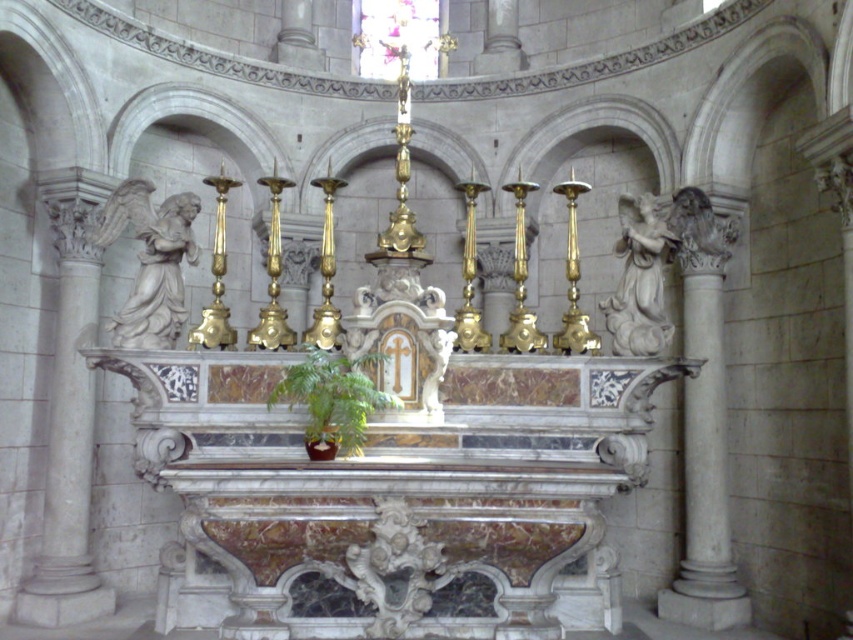
Between white marble column at right and white marble angel at left, which one is positioned higher?

white marble angel at left

Does point (688, 208) come behind point (169, 307)?

That is True.

Who is more distant from viewer, (718, 506) or (126, 346)?

Point (718, 506)

Identify the location of white marble column at right. (703, 424).

Does white marble angel at right have a smaller size compared to green leafy plant at center?

Incorrect, white marble angel at right is not smaller in size than green leafy plant at center.

Is white marble angel at right below green leafy plant at center?

No.

Image resolution: width=853 pixels, height=640 pixels. Find the location of `white marble angel at right`. white marble angel at right is located at coordinates (640, 276).

Does white marble column at right come in front of green leafy plant at center?

No.

Between point (677, 579) and point (322, 442), which one is positioned in front?

Point (322, 442)

Where is `white marble column at right`? white marble column at right is located at coordinates (703, 424).